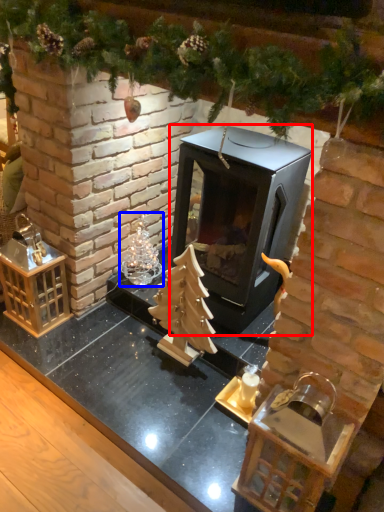
Question: Which of the following is the closest to the observer, fireplace (highlighted by a red box) or christmas decoration (highlighted by a blue box)?

Choices:
 (A) fireplace
 (B) christmas decoration

Answer: (A)